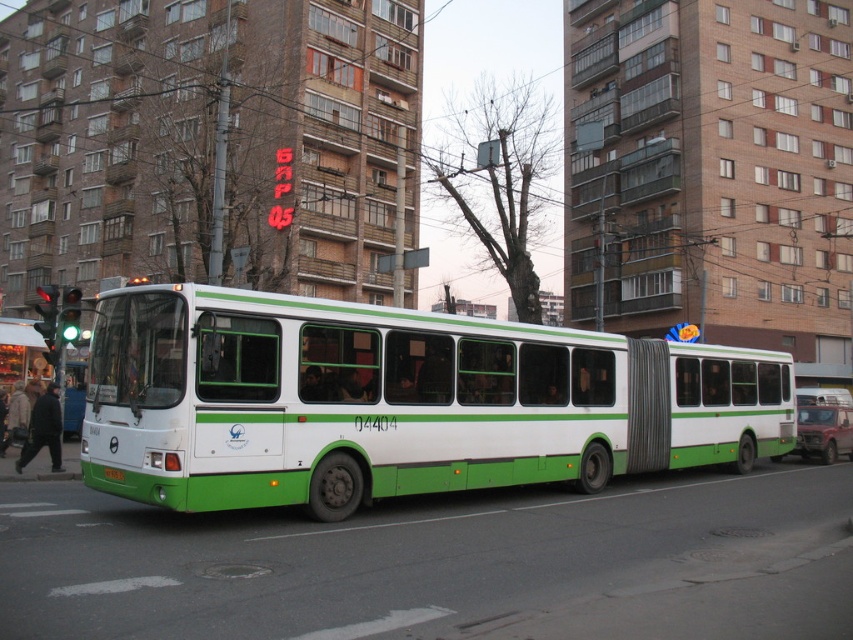
Question: Which point appears closest to the camera in this image?

Choices:
 (A) (74, 436)
 (B) (635, 452)
 (C) (119, 476)

Answer: (C)

Question: Is green matte bus at center to the left of green rubber bus stop at left from the viewer's perspective?

Choices:
 (A) no
 (B) yes

Answer: (A)

Question: Which of the following is the farthest from the observer?

Choices:
 (A) (83, 330)
 (B) (433, 362)

Answer: (A)

Question: Is green rubber bus stop at left to the right of green matte license plate at center from the viewer's perspective?

Choices:
 (A) no
 (B) yes

Answer: (A)

Question: Which point appears closest to the camera in this image?

Choices:
 (A) (756, 365)
 (B) (64, 419)
 (C) (112, 468)

Answer: (C)

Question: Is green matte bus at center closer to the viewer compared to green rubber bus stop at left?

Choices:
 (A) no
 (B) yes

Answer: (B)